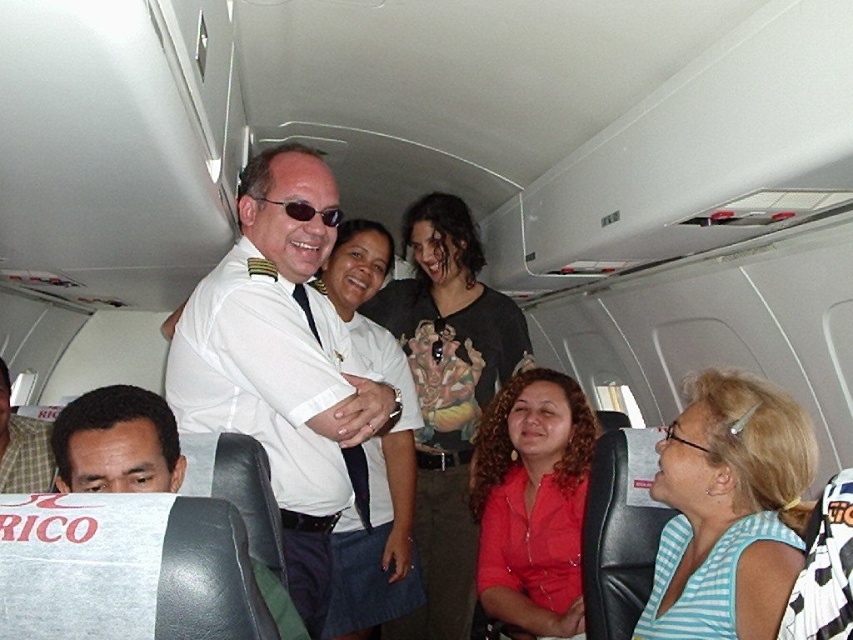
Question: Among these objects, which one is nearest to the camera?

Choices:
 (A) white shirt at center
 (B) white uniform at center

Answer: (B)

Question: Which of these objects is positioned farthest from the white shirt at center?

Choices:
 (A) brushed metal water at bottle left
 (B) matte white shirt at lower left
 (C) smooth skin face at lower left

Answer: (A)

Question: Which point is closer to the camera taking this photo?

Choices:
 (A) (3, 369)
 (B) (500, 429)

Answer: (B)

Question: Is matte red shirt at center further to the viewer compared to white shirt at center?

Choices:
 (A) no
 (B) yes

Answer: (B)

Question: Can you confirm if matte white shirt at lower left is bigger than brushed metal water at bottle left?

Choices:
 (A) no
 (B) yes

Answer: (B)

Question: Observing the image, what is the correct spatial positioning of white uniform at center in reference to blue striped shirt at lower right?

Choices:
 (A) below
 (B) above

Answer: (B)